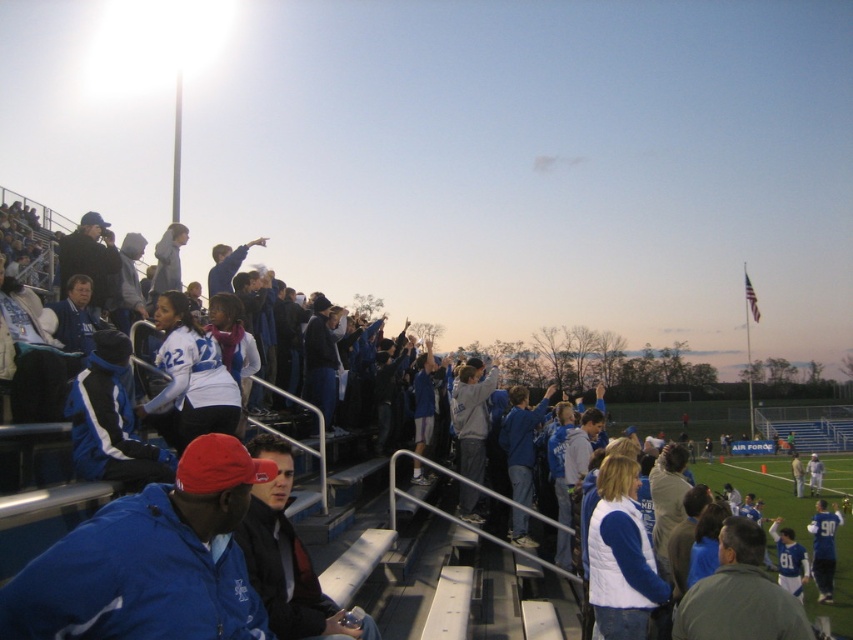
Question: In this image, where is blue matte jacket at lower left located relative to blue fabric jacket at center?

Choices:
 (A) left
 (B) right

Answer: (B)

Question: Among these objects, which one is nearest to the camera?

Choices:
 (A) blue matte jacket at lower left
 (B) blue fabric jacket at center

Answer: (A)

Question: Which point is closer to the camera?

Choices:
 (A) blue fabric jacket at center
 (B) blue matte jacket at lower left

Answer: (B)

Question: Considering the relative positions of blue matte jacket at lower left and blue fabric jacket at center in the image provided, where is blue matte jacket at lower left located with respect to blue fabric jacket at center?

Choices:
 (A) left
 (B) right

Answer: (B)

Question: Does blue matte jacket at lower left have a lesser width compared to blue fabric jacket at center?

Choices:
 (A) no
 (B) yes

Answer: (B)